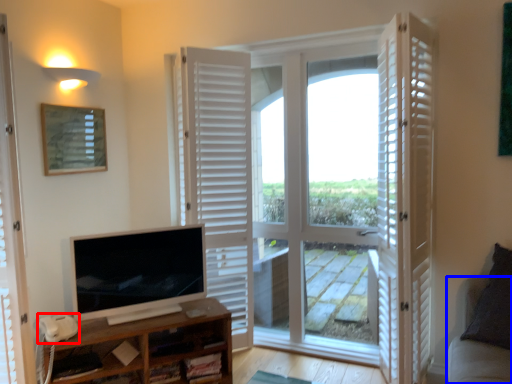
Question: Which of the following is the closest to the observer, corded phone (highlighted by a red box) or couch (highlighted by a blue box)?

Choices:
 (A) corded phone
 (B) couch

Answer: (B)